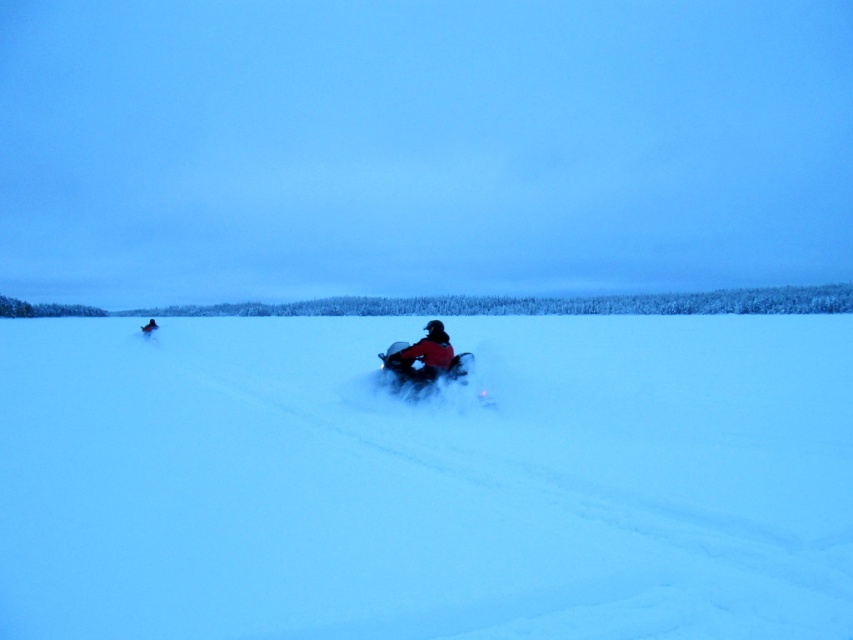
Which is more to the left, shiny metallic snowmobile at center or red matte snowmobile at center?

Positioned to the left is shiny metallic snowmobile at center.

Is point (416, 388) farther from viewer compared to point (392, 365)?

No, it is not.

Does point (386, 372) come in front of point (433, 360)?

No, (386, 372) is further to viewer.

Image resolution: width=853 pixels, height=640 pixels. I want to click on shiny metallic snowmobile at center, so click(422, 369).

Is white powdery snow at center positioned before red matte snowmobile at center?

That is True.

Can you confirm if white powdery snow at center is shorter than red matte snowmobile at center?

Incorrect, white powdery snow at center's height does not fall short of red matte snowmobile at center's.

This screenshot has height=640, width=853. Describe the element at coordinates (426, 481) in the screenshot. I see `white powdery snow at center` at that location.

What are the coordinates of `white powdery snow at center` in the screenshot? It's located at (426, 481).

Can you confirm if white powdery snow at center is wider than shiny metallic snowmobile at center?

Yes, white powdery snow at center is wider than shiny metallic snowmobile at center.

Does white powdery snow at center have a larger size compared to shiny metallic snowmobile at center?

Yes.

Does point (695, 612) lie in front of point (418, 342)?

Yes, point (695, 612) is closer to viewer.

At what (x,y) coordinates should I click in order to perform the action: click on white powdery snow at center. Please return your answer as a coordinate pair (x, y). The width and height of the screenshot is (853, 640). Looking at the image, I should click on (426, 481).